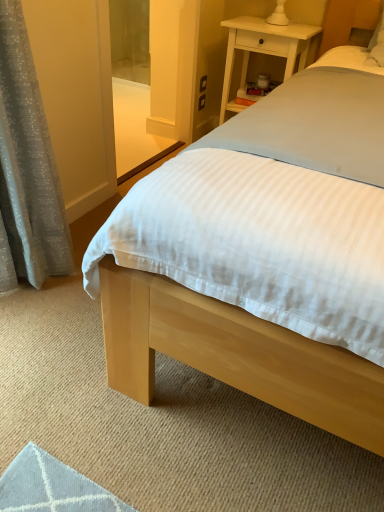
What is the approximate width of light wood bed at center?

The width of light wood bed at center is 7.10 feet.

The image size is (384, 512). Find the location of `transparent glass screen door at upper center`. transparent glass screen door at upper center is located at coordinates (133, 89).

I want to click on light wood bed at center, so click(235, 355).

Is transparent glass screen door at upper center turned away from light wood bed at center?

transparent glass screen door at upper center does not have its back to light wood bed at center.

Are transparent glass screen door at upper center and light wood bed at center making contact?

transparent glass screen door at upper center is not next to light wood bed at center, and they're not touching.

Is transparent glass screen door at upper center at the left side of light wood bed at center?

Indeed, transparent glass screen door at upper center is positioned on the left side of light wood bed at center.

Which point is more forward, [122,29] or [286,367]?

Point [286,367]

Is light wood bed at center next to transparent glass screen door at upper center?

They are not placed beside each other.

From the image's perspective, between light wood bed at center and transparent glass screen door at upper center, which one is located above?

From the image's view, transparent glass screen door at upper center is above.

Measure the distance between light wood bed at center and transparent glass screen door at upper center.

28.63 inches.

Is light wood bed at center closer to camera compared to transparent glass screen door at upper center?

Yes, it is.

How many degrees apart are the facing directions of transparent glass screen door at upper center and gray textured curtain at left?

There is a 3.49-degree angle between the facing directions of transparent glass screen door at upper center and gray textured curtain at left.

Between transparent glass screen door at upper center and gray textured curtain at left, which one has more height?

gray textured curtain at left is taller.

Where is `curtain above the transparent glass screen door at upper center (from a real-world perspective)`? curtain above the transparent glass screen door at upper center (from a real-world perspective) is located at coordinates (27, 167).

Considering the relative sizes of gray textured curtain at left and white wood nightstand at upper right in the image provided, is gray textured curtain at left wider than white wood nightstand at upper right?

No.

Would you say gray textured curtain at left is a long distance from white wood nightstand at upper right?

That's right, there is a large distance between gray textured curtain at left and white wood nightstand at upper right.

How different are the orientations of gray textured curtain at left and white wood nightstand at upper right in degrees?

The angular difference between gray textured curtain at left and white wood nightstand at upper right is 92.3 degrees.

In the image, is gray textured curtain at left on the left side or the right side of white wood nightstand at upper right?

From the image, it's evident that gray textured curtain at left is to the left of white wood nightstand at upper right.

From their relative heights in the image, would you say gray textured curtain at left is taller or shorter than light wood bed at center?

gray textured curtain at left is shorter than light wood bed at center.

What's the angular difference between gray textured curtain at left and light wood bed at center's facing directions?

92.7 degrees.

Looking at this image, is gray textured curtain at left inside or outside of light wood bed at center?

gray textured curtain at left is not inside light wood bed at center, it's outside.

Identify the location of bed below the gray textured curtain at left (from a real-world perspective). (235, 355).

Between light wood bed at center and white wood nightstand at upper right, which one has less height?

white wood nightstand at upper right is shorter.

Which is more to the left, light wood bed at center or white wood nightstand at upper right?

From the viewer's perspective, white wood nightstand at upper right appears more on the left side.

Is point (307, 41) closer or farther from the camera than point (285, 54)?

Point (307, 41).

Can you confirm if light wood bed at center is thinner than white wood nightstand at upper right?

Incorrect, the width of light wood bed at center is not less than that of white wood nightstand at upper right.

Which of these two, white wood nightstand at upper right or transparent glass screen door at upper center, stands shorter?

white wood nightstand at upper right is shorter.

Would you say transparent glass screen door at upper center is part of white wood nightstand at upper right's contents?

No.

Can you tell me how much white wood nightstand at upper right and transparent glass screen door at upper center differ in facing direction?

white wood nightstand at upper right and transparent glass screen door at upper center are facing 88.8 degrees away from each other.

From the image's perspective, which is below, white wood nightstand at upper right or transparent glass screen door at upper center?

From the image's view, transparent glass screen door at upper center is below.

Identify the location of screen door on the left of the light wood bed at center. (133, 89).

At what (x,y) coordinates should I click in order to perform the action: click on bed that appears below the transparent glass screen door at upper center (from the image's perspective). Please return your answer as a coordinate pair (x, y). Image resolution: width=384 pixels, height=512 pixels. Looking at the image, I should click on (235, 355).

Which object lies nearer to the anchor point gray textured curtain at left, light wood bed at center or white wood nightstand at upper right?

white wood nightstand at upper right.

Which object lies further to the anchor point white wood nightstand at upper right, light wood bed at center or gray textured curtain at left?

The object further to white wood nightstand at upper right is gray textured curtain at left.

Estimate the real-world distances between objects in this image. Which object is further from light wood bed at center, white wood nightstand at upper right or transparent glass screen door at upper center?

transparent glass screen door at upper center lies further to light wood bed at center than the other object.

Based on their spatial positions, is white wood nightstand at upper right or light wood bed at center closer to gray textured curtain at left?

The object closer to gray textured curtain at left is white wood nightstand at upper right.

Which object lies further to the anchor point gray textured curtain at left, white wood nightstand at upper right or transparent glass screen door at upper center?

white wood nightstand at upper right is further to gray textured curtain at left.

Considering their positions, is gray textured curtain at left positioned closer to white wood nightstand at upper right than light wood bed at center?

Based on the image, light wood bed at center appears to be nearer to white wood nightstand at upper right.

Estimate the real-world distances between objects in this image. Which object is closer to transparent glass screen door at upper center, gray textured curtain at left or light wood bed at center?

light wood bed at center is positioned closer to the anchor transparent glass screen door at upper center.

Based on their spatial positions, is gray textured curtain at left or white wood nightstand at upper right closer to light wood bed at center?

white wood nightstand at upper right lies closer to light wood bed at center than the other object.

Locate an element on the screen. The height and width of the screenshot is (512, 384). screen door between light wood bed at center and white wood nightstand at upper right in the front-back direction is located at coordinates (133, 89).

Where is `curtain positioned between light wood bed at center and transparent glass screen door at upper center from near to far`? This screenshot has height=512, width=384. curtain positioned between light wood bed at center and transparent glass screen door at upper center from near to far is located at coordinates (27, 167).

You are a GUI agent. You are given a task and a screenshot of the screen. Output one action in this format:
    pyautogui.click(x=<x>, y=<y>)
    Task: Click on the screen door positioned between gray textured curtain at left and white wood nightstand at upper right from near to far
    This screenshot has width=384, height=512.
    Given the screenshot: What is the action you would take?
    pyautogui.click(x=133, y=89)

Image resolution: width=384 pixels, height=512 pixels. Identify the location of curtain between light wood bed at center and white wood nightstand at upper right along the z-axis. (27, 167).